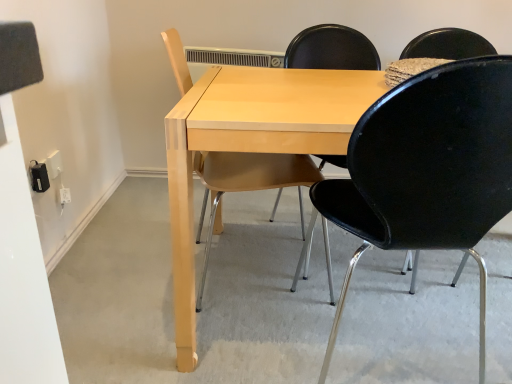
The image size is (512, 384). What are the coordinates of `vacant region to the left of light wood table at center` in the screenshot? It's located at (130, 269).